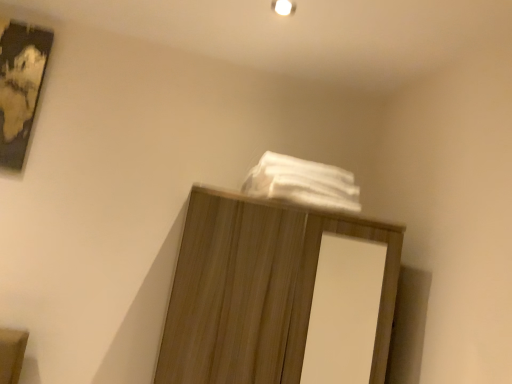
Describe the element at coordinates (302, 183) in the screenshot. This screenshot has width=512, height=384. I see `white soft towel at upper center` at that location.

In order to click on white soft towel at upper center in this screenshot , I will do `click(302, 183)`.

Find the location of a particular element. This screenshot has width=512, height=384. white soft towel at upper center is located at coordinates (302, 183).